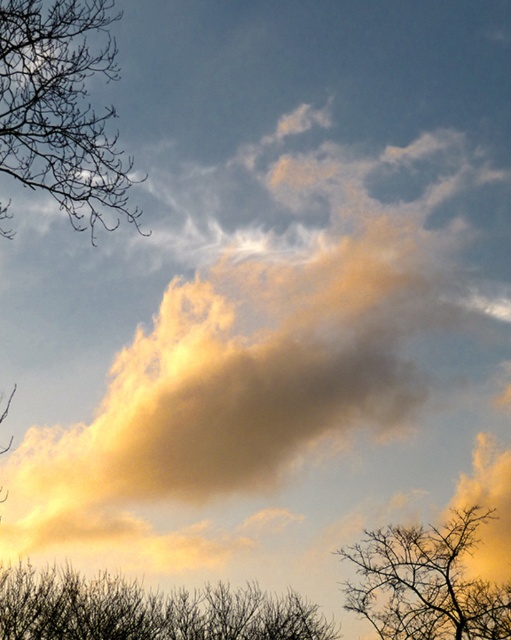
You are an artist trying to paint the scene. You want to ensure the bare branches at left and silhouette bare branches at bottom are proportionally accurate. Which of the two has a smaller width?

The bare branches at left has a lesser width compared to silhouette bare branches at bottom, so it is the smaller one.

You are standing in a park and see the point marked at coordinates [61,108]. Based on the scene description, where is this point located?

The point at coordinates [61,108] is located on the bare branches at the left side of the image.